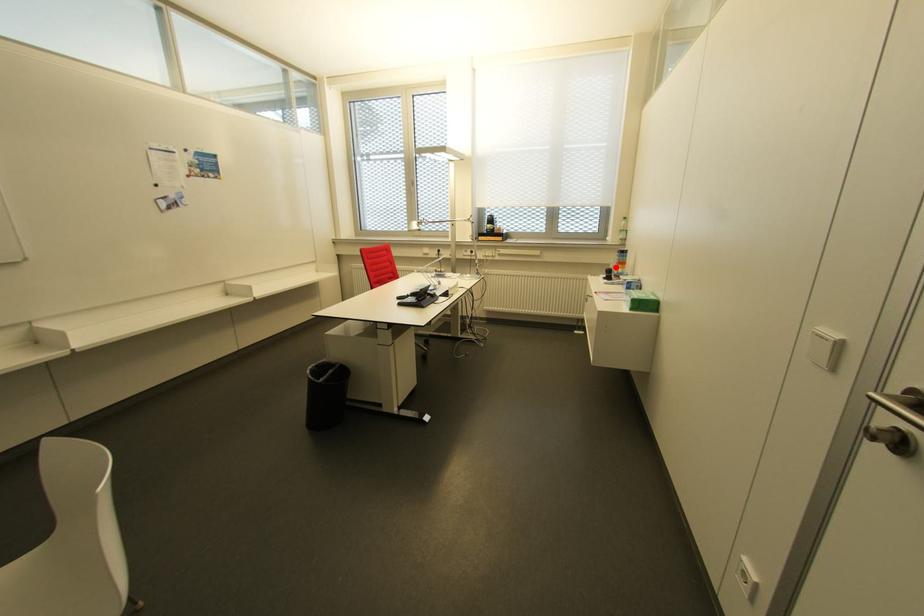
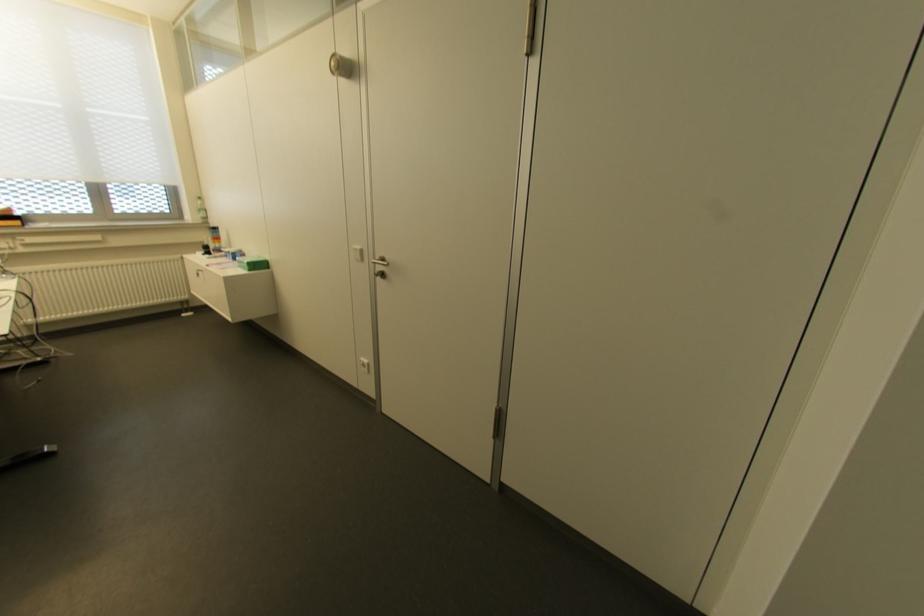
Question: I am providing you with two images of the same scene from different viewpoints. Given a red point in image1, look at the same physical point in image2. Is it:

Choices:
 (A) Closer to the viewpoint
 (B) Farther from the viewpoint

Answer: (B)